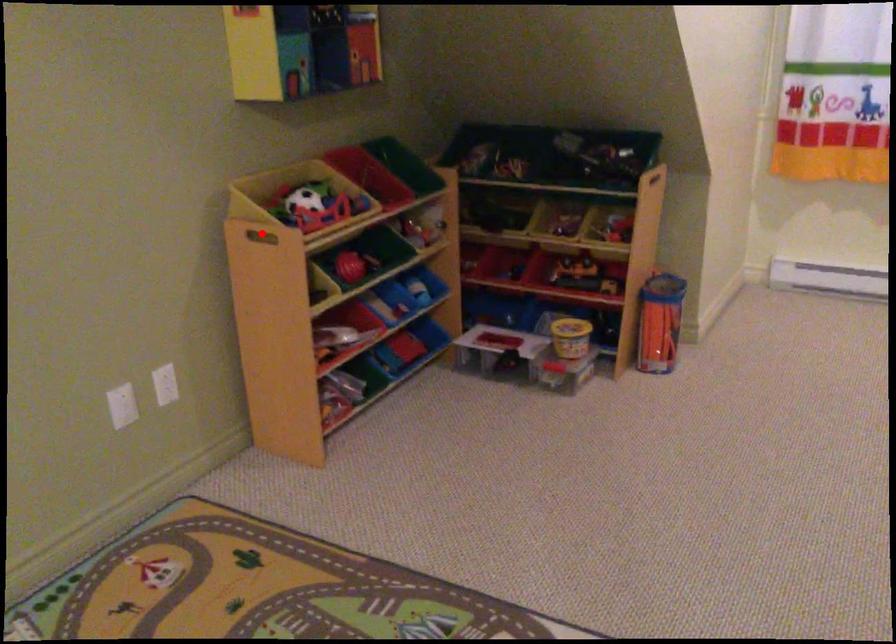
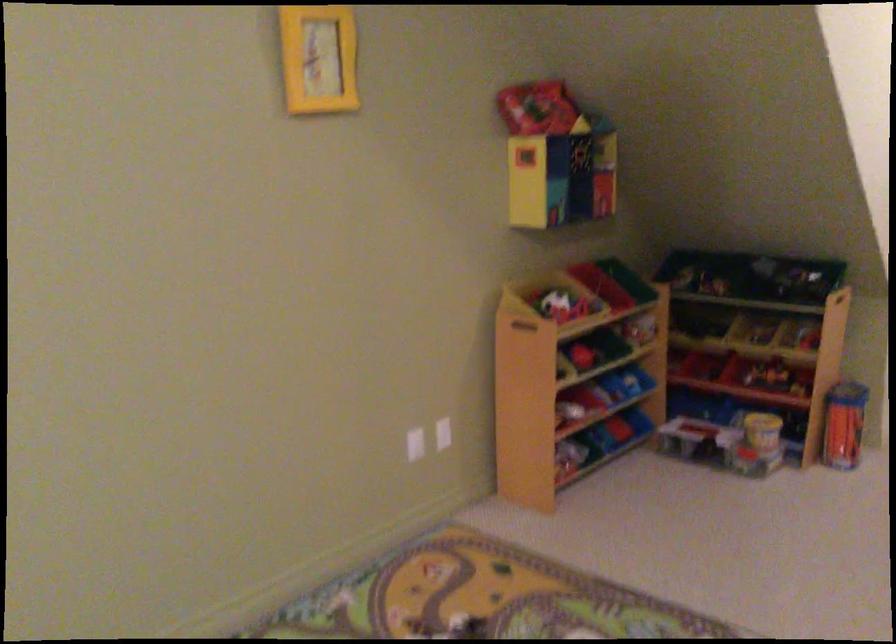
Question: A red point is marked in image1. In image2, is the corresponding 3D point closer to the camera or farther? Reply with the corresponding letter.

Choices:
 (A) The corresponding 3D point is closer.
 (B) The corresponding 3D point is farther.

Answer: (B)